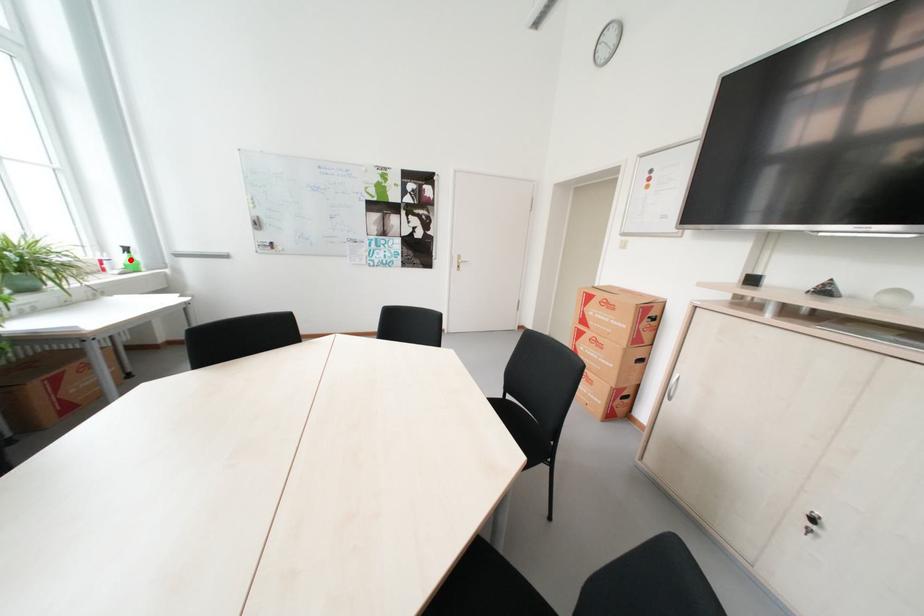
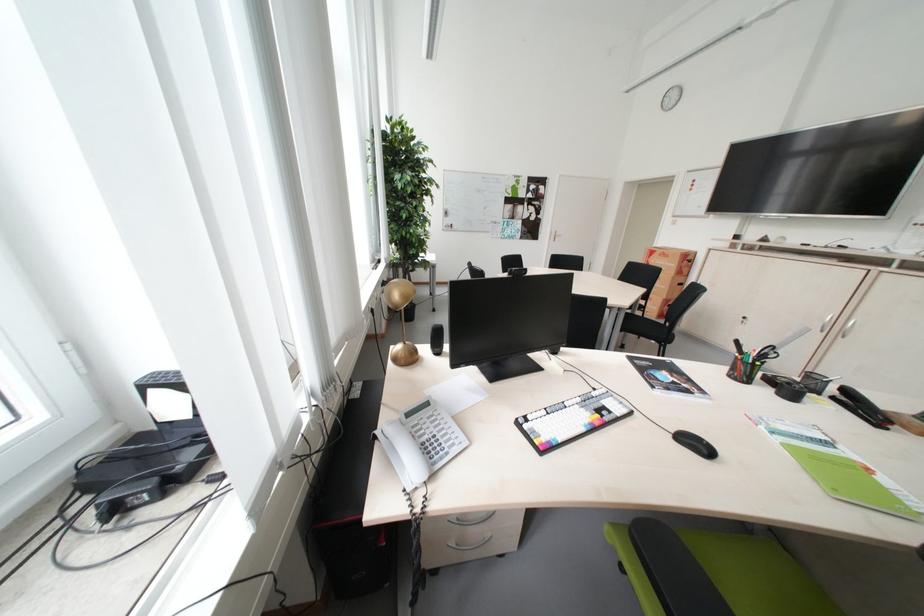
Question: I am providing you with two images of the same scene from different viewpoints. A red point is marked on the first image. Is the red point's position out of view in image 2?

Choices:
 (A) Yes
 (B) No

Answer: (A)